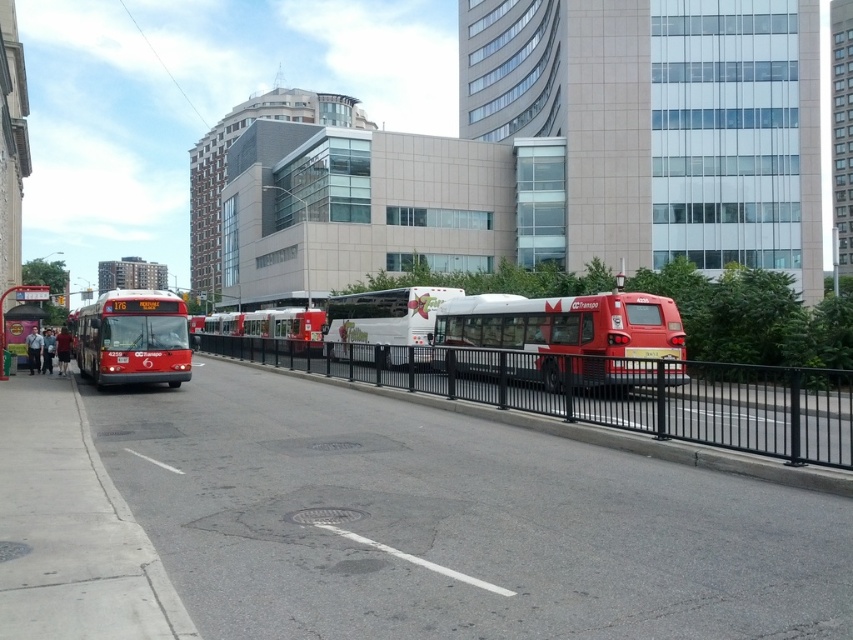
Does black metal fence at center have a larger size compared to red matte bus at center?

Actually, black metal fence at center might be smaller than red matte bus at center.

Does black metal fence at center appear on the right side of red matte bus at center?

Indeed, black metal fence at center is positioned on the right side of red matte bus at center.

Describe the element at coordinates (627, 394) in the screenshot. I see `black metal fence at center` at that location.

Where is `black metal fence at center`? The image size is (853, 640). black metal fence at center is located at coordinates (627, 394).

Who is more forward, (733,445) or (3,353)?

Point (733,445)

Between black metal fence at center and metallic bus stop at lower left, which one has more height?

metallic bus stop at lower left is taller.

Is point (604, 381) farther from viewer compared to point (0, 310)?

That is False.

Image resolution: width=853 pixels, height=640 pixels. In order to click on black metal fence at center in this screenshot , I will do `click(627, 394)`.

Locate an element on the screen. The image size is (853, 640). white matte bus at center is located at coordinates (384, 323).